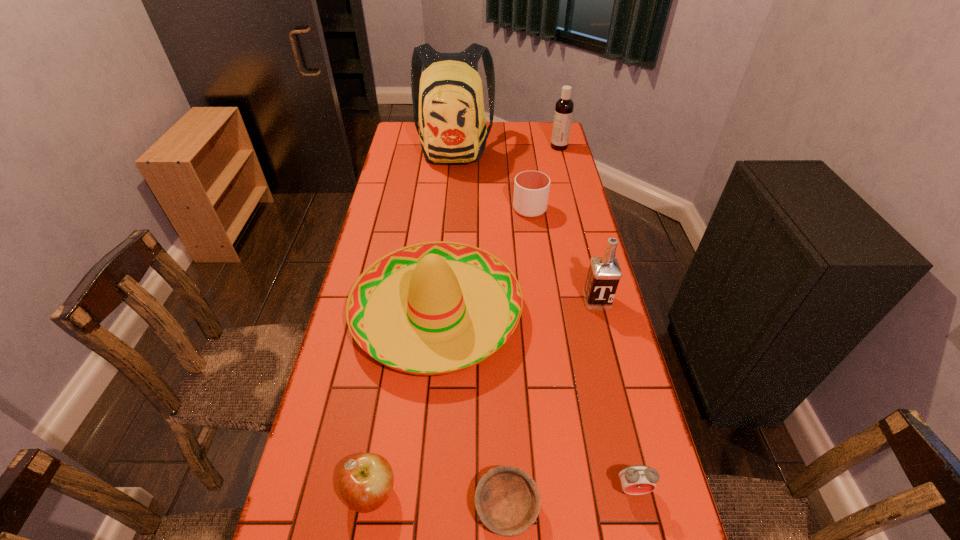
At what (x,y) coordinates should I click in order to perform the action: click on sombrero that is positioned at the left edge. Please return your answer as a coordinate pair (x, y). This screenshot has height=540, width=960. Looking at the image, I should click on (x=433, y=308).

Where is `apple present at the left edge`? The height and width of the screenshot is (540, 960). apple present at the left edge is located at coordinates (366, 480).

You are a GUI agent. You are given a task and a screenshot of the screen. Output one action in this format:
    pyautogui.click(x=<x>, y=<y>)
    Task: Click on the dishwasher detergent situated at the right edge
    Image resolution: width=960 pixels, height=540 pixels.
    Given the screenshot: What is the action you would take?
    pyautogui.click(x=564, y=106)

Identify the location of vodka that is positioned at the right edge. Image resolution: width=960 pixels, height=540 pixels. (604, 273).

Find the location of a particular element. This screenshot has width=960, height=540. cup that is at the right edge is located at coordinates (531, 188).

Where is `alarm clock at the right edge`? alarm clock at the right edge is located at coordinates (638, 479).

Where is `object that is at the far left corner`? This screenshot has width=960, height=540. object that is at the far left corner is located at coordinates (447, 98).

At what (x,y) coordinates should I click in order to perform the action: click on object that is positioned at the far right corner. Please return your answer as a coordinate pair (x, y). Looking at the image, I should click on (564, 106).

At what (x,y) coordinates should I click in order to perform the action: click on vacant region at the far edge of the desktop. Please return your answer as a coordinate pair (x, y). Image resolution: width=960 pixels, height=540 pixels. Looking at the image, I should click on (514, 126).

Where is `free location at the left edge of the desktop`? The width and height of the screenshot is (960, 540). free location at the left edge of the desktop is located at coordinates (325, 420).